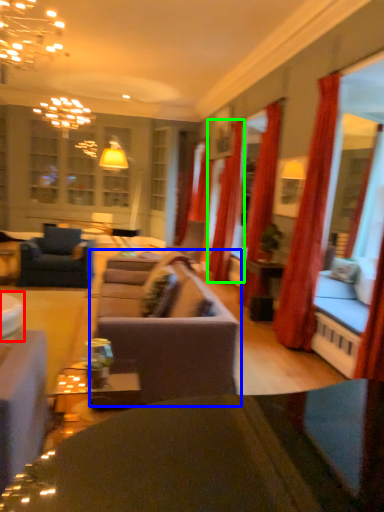
Question: Which object is positioned closest to table (highlighted by a red box)? Select from studio couch (highlighted by a blue box) and curtain (highlighted by a green box).

Choices:
 (A) studio couch
 (B) curtain

Answer: (A)